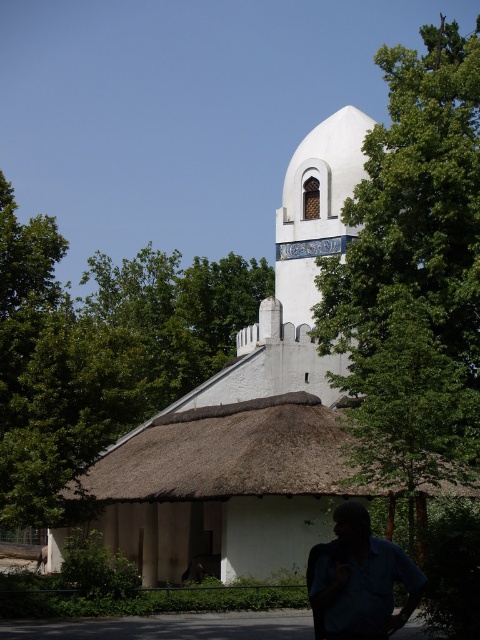
Question: Which object is farther from the camera taking this photo?

Choices:
 (A) green leafy tree at upper left
 (B) white stucco church at center
 (C) blue fabric shirt at lower right
 (D) green leafy tree at upper center

Answer: (B)

Question: Is green leafy tree at upper center bigger than blue fabric shirt at lower right?

Choices:
 (A) yes
 (B) no

Answer: (A)

Question: Is green leafy tree at upper center above green leafy tree at upper left?

Choices:
 (A) no
 (B) yes

Answer: (B)

Question: Which object is closer to the camera taking this photo?

Choices:
 (A) green leafy tree at upper left
 (B) green leafy tree at upper center
 (C) white stucco church at center

Answer: (B)

Question: Can you confirm if green leafy tree at upper left is smaller than blue fabric shirt at lower right?

Choices:
 (A) no
 (B) yes

Answer: (A)

Question: Estimate the real-world distances between objects in this image. Which object is closer to the blue fabric shirt at lower right?

Choices:
 (A) white stucco church at center
 (B) green leafy tree at upper left

Answer: (A)